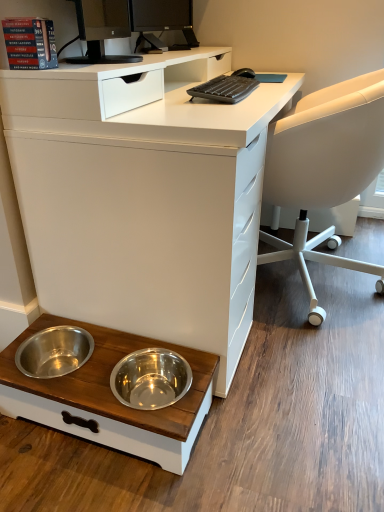
Question: From their relative heights in the image, would you say red paper book at upper left is taller or shorter than white matte desk at lower left?

Choices:
 (A) tall
 (B) short

Answer: (B)

Question: Considering the positions of red paper book at upper left and white matte desk at lower left in the image, is red paper book at upper left bigger or smaller than white matte desk at lower left?

Choices:
 (A) big
 (B) small

Answer: (B)

Question: Which of these objects is positioned farthest from the white plastic chair at right?

Choices:
 (A) white matte desk at lower left
 (B) black plastic keyboard at upper center
 (C) wooden pet bowls at lower left
 (D) black glossy monitor at upper center
 (E) red paper book at upper left

Answer: (D)

Question: Which is nearer to the red paper book at upper left?

Choices:
 (A) wooden pet bowls at lower left
 (B) black plastic keyboard at upper center
 (C) white plastic chair at right
 (D) black glossy monitor at upper center
 (E) white matte desk at lower left

Answer: (E)